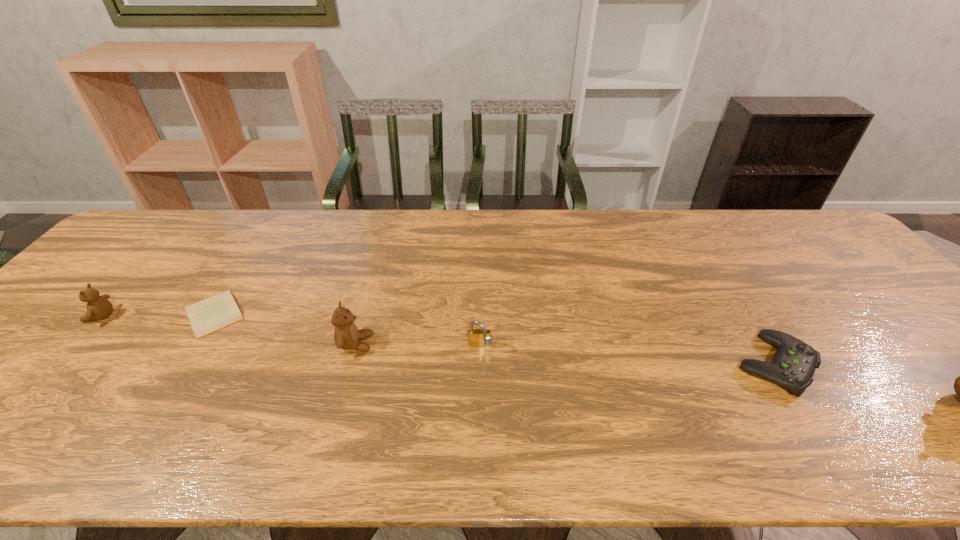
Locate an element on the screen. The width and height of the screenshot is (960, 540). free space at the right edge is located at coordinates (847, 292).

The width and height of the screenshot is (960, 540). What are the coordinates of `free space at the far left corner of the desktop` in the screenshot? It's located at (174, 239).

You are a GUI agent. You are given a task and a screenshot of the screen. Output one action in this format:
    pyautogui.click(x=<x>, y=<y>)
    Task: Click on the vacant space at the far right corner of the desktop
    The width and height of the screenshot is (960, 540).
    Given the screenshot: What is the action you would take?
    pyautogui.click(x=811, y=243)

You are a GUI agent. You are given a task and a screenshot of the screen. Output one action in this format:
    pyautogui.click(x=<x>, y=<y>)
    Task: Click on the vacant area between the leftmost object and the rightmost object
    
    Given the screenshot: What is the action you would take?
    pyautogui.click(x=438, y=340)

Where is `vacant space in between the taller teddy bear and the fourth object from right to left`? Image resolution: width=960 pixels, height=540 pixels. vacant space in between the taller teddy bear and the fourth object from right to left is located at coordinates (x=285, y=329).

Identify the location of free space between the second object from left to right and the control. This screenshot has height=540, width=960. (494, 339).

Where is `empty space that is in between the fourth tallest object and the left teddy bear`? empty space that is in between the fourth tallest object and the left teddy bear is located at coordinates (438, 340).

This screenshot has height=540, width=960. I want to click on vacant area that lies between the second object from left to right and the taller teddy bear, so click(285, 329).

The image size is (960, 540). Find the location of `free space between the shorter teddy bear and the control`. free space between the shorter teddy bear and the control is located at coordinates (438, 340).

Identify the location of free space that is in between the shortest object and the leftmost object. (157, 315).